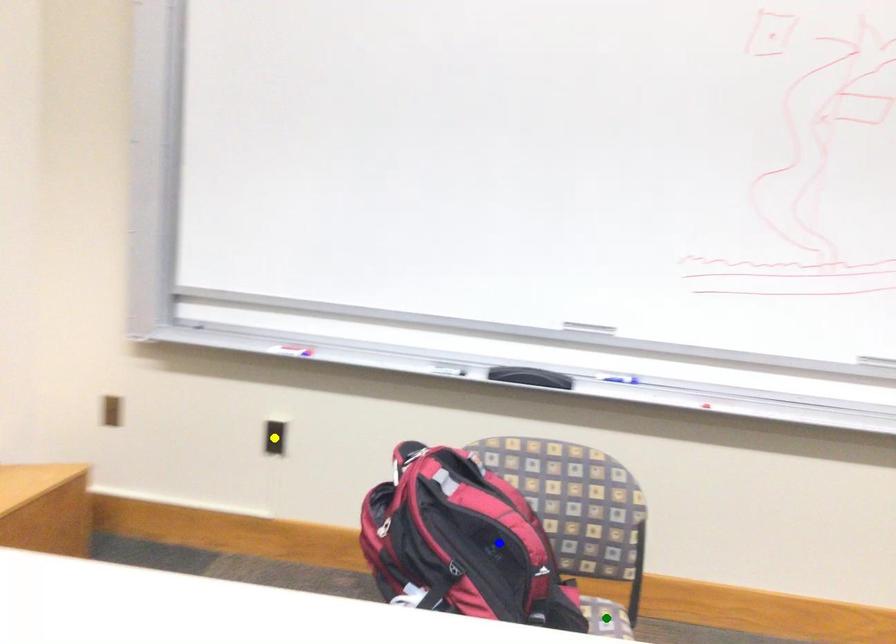
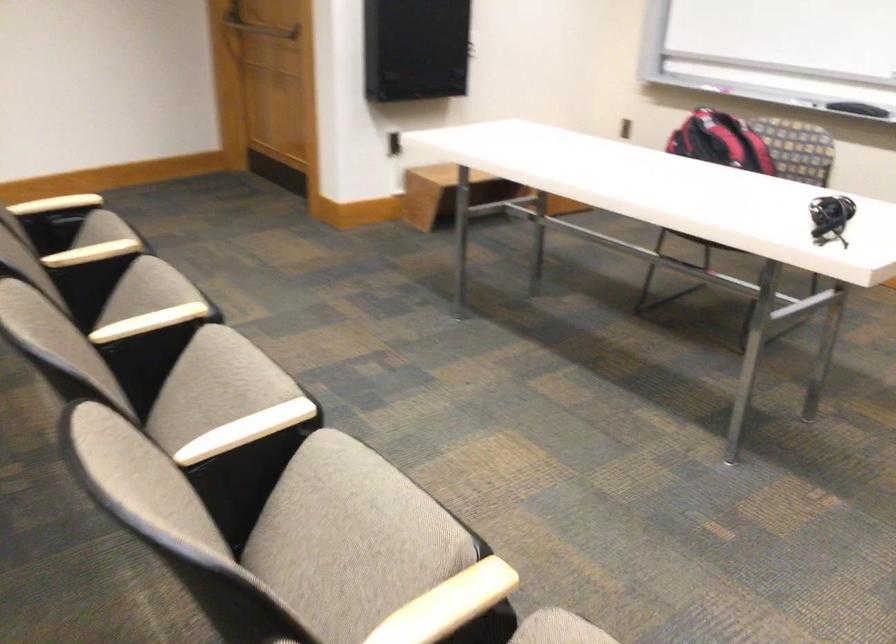
I am providing you with two images of the same scene from different viewpoints. Three points are marked in image1. Which point corresponds to a part or object that is occluded in image2?In image1, three points are marked. Which of them correspond to a part or object that is occluded in image2?Among the three points shown in image1, which one corresponds to a part or object that is no longer visible due to occlusion in image2?

yellow point, green point cannot be seen in image2.